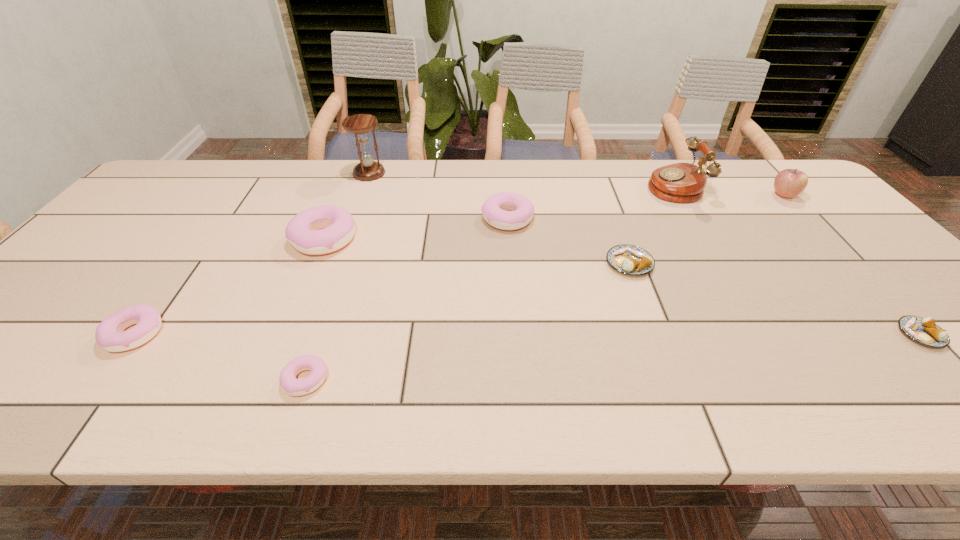
Where is `free space between the tallest pastry and the nearest pink pastry`? Image resolution: width=960 pixels, height=540 pixels. free space between the tallest pastry and the nearest pink pastry is located at coordinates (315, 309).

Locate an element on the screen. vacant space that is in between the biggest pink pastry and the nearer brown pastry is located at coordinates (622, 286).

Where is `vacant space in between the telephone and the right brown pastry`? The height and width of the screenshot is (540, 960). vacant space in between the telephone and the right brown pastry is located at coordinates (797, 260).

Image resolution: width=960 pixels, height=540 pixels. What are the coordinates of `free point between the leftmost object and the right brown pastry` in the screenshot? It's located at (528, 334).

The width and height of the screenshot is (960, 540). What are the coordinates of `empty space between the telephone and the second tallest pastry` in the screenshot? It's located at (590, 202).

I want to click on unoccupied area between the second nearest pink pastry and the second tallest pastry, so click(x=322, y=276).

The image size is (960, 540). In order to click on free spot between the farther brown pastry and the seventh shortest object in this screenshot , I will do `click(707, 229)`.

Find the location of a particular element. The image size is (960, 540). free area in between the sixth shortest object and the nearest pastry is located at coordinates (315, 309).

Locate an element on the screen. This screenshot has height=540, width=960. object that is the fifth nearest to the tallest object is located at coordinates (632, 260).

Where is `object that is the seventh nearest to the second pastry from right to left`? The width and height of the screenshot is (960, 540). object that is the seventh nearest to the second pastry from right to left is located at coordinates (360, 124).